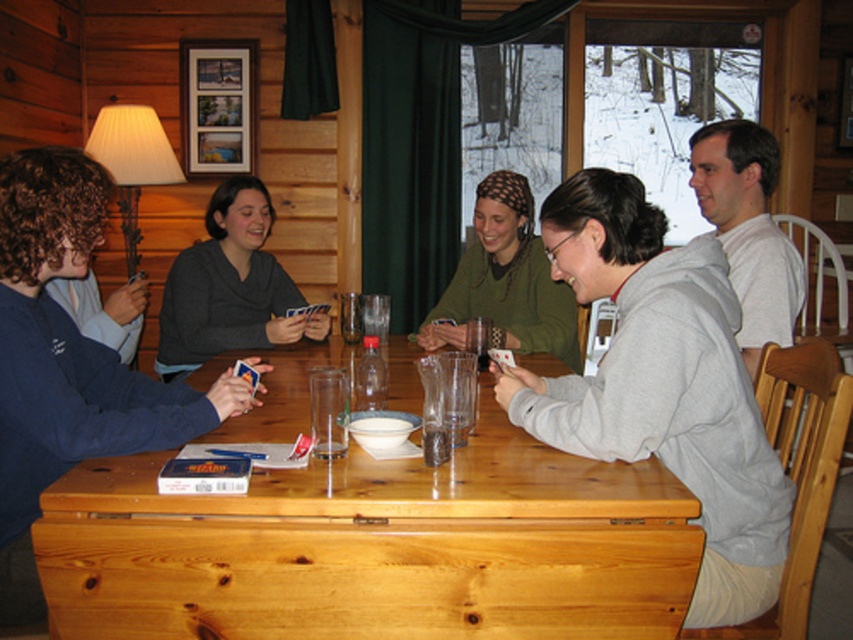
Does light brown wood table at center appear under translucent glass at table center?

Correct, light brown wood table at center is located below translucent glass at table center.

Does light brown wood table at center come behind translucent glass at table center?

No, light brown wood table at center is closer to the viewer.

Does point (170, 534) come behind point (445, 442)?

No, (170, 534) is in front of (445, 442).

The image size is (853, 640). What are the coordinates of `light brown wood table at center` in the screenshot? It's located at (374, 548).

Looking at this image, does light brown wood table at center have a greater height compared to green knit sweater at center?

No, light brown wood table at center is not taller than green knit sweater at center.

Does light brown wood table at center appear under green knit sweater at center?

Yes, light brown wood table at center is below green knit sweater at center.

Between point (154, 536) and point (564, 348), which one is positioned behind?

The point (564, 348) is more distant.

You are a GUI agent. You are given a task and a screenshot of the screen. Output one action in this format:
    pyautogui.click(x=<x>, y=<y>)
    Task: Click on the light brown wood table at center
    The height and width of the screenshot is (640, 853).
    Given the screenshot: What is the action you would take?
    pyautogui.click(x=374, y=548)

Which of these two, gray sweatshirt at center or white cotton shirt at upper right, stands shorter?

white cotton shirt at upper right is shorter.

Who is more distant from viewer, (653,422) or (746,257)?

The point (746,257) is behind.

Does point (654, 332) come behind point (746, 244)?

No, (654, 332) is in front of (746, 244).

This screenshot has height=640, width=853. I want to click on gray sweatshirt at center, so click(x=663, y=385).